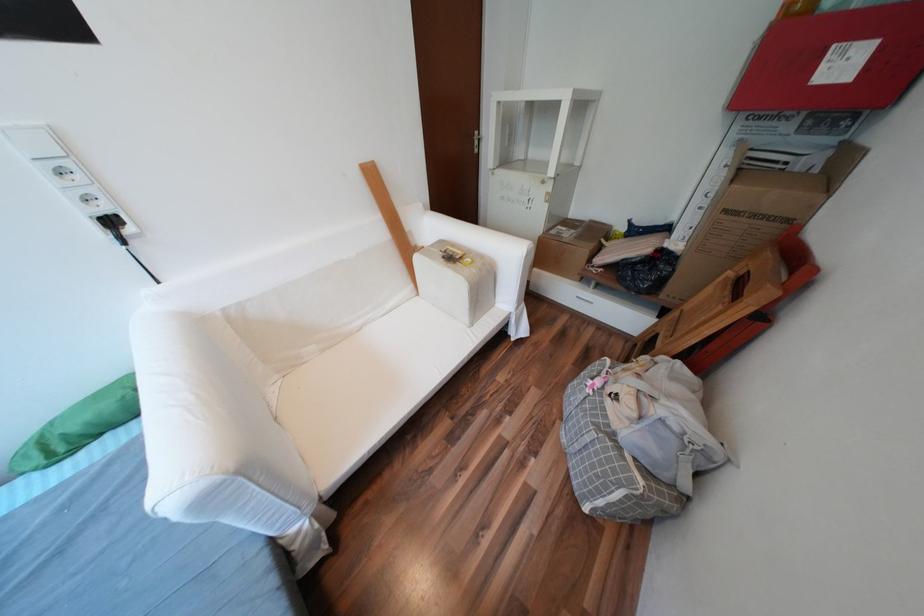
You are a GUI agent. You are given a task and a screenshot of the screen. Output one action in this format:
    pyautogui.click(x=<x>, y=<y>)
    Task: Click on the white sofa armrest
    
    Given the screenshot: What is the action you would take?
    coord(493,262)